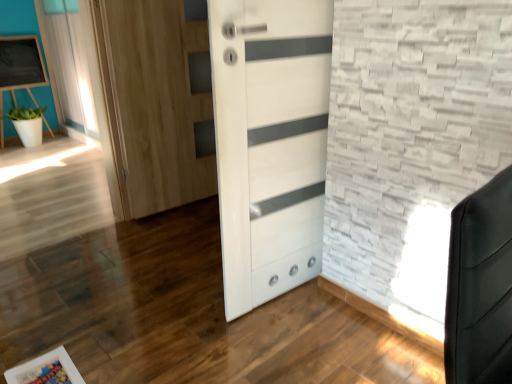
Find the location of a particular element. The image size is (512, 384). free space to the back side of wooden picture frame at lower left is located at coordinates (72, 337).